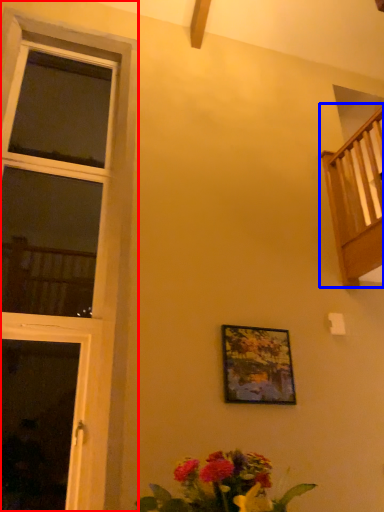
Question: Which of the following is the farthest to the observer, window (highlighted by a red box) or balcony (highlighted by a blue box)?

Choices:
 (A) window
 (B) balcony

Answer: (B)